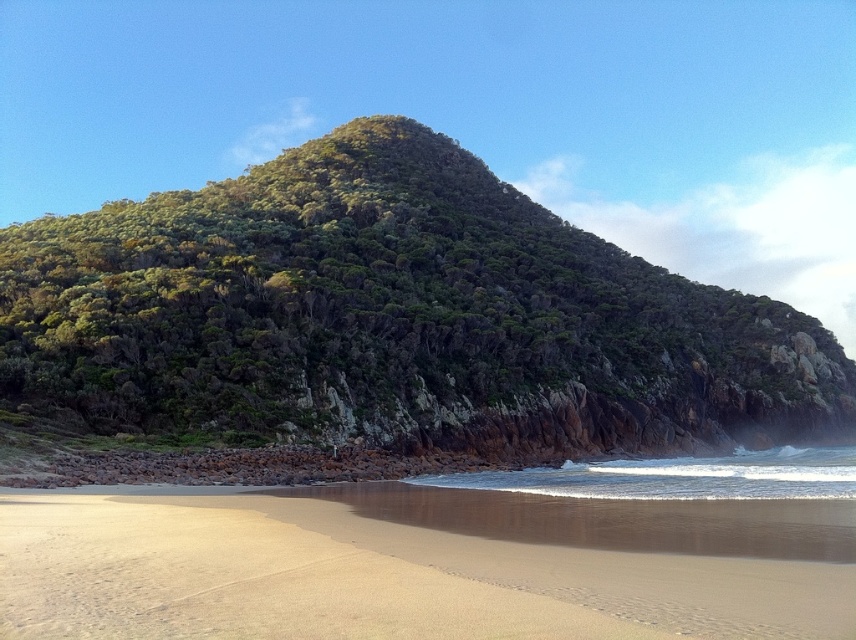
Can you confirm if sandy beach at lower center is smaller than white foamy water at lower center?

Indeed, sandy beach at lower center has a smaller size compared to white foamy water at lower center.

How distant is sandy beach at lower center from white foamy water at lower center?

They are 33.34 meters apart.

Is point (282, 618) farther from camera compared to point (535, 480)?

No, (282, 618) is closer to viewer.

At what (x,y) coordinates should I click in order to perform the action: click on sandy beach at lower center. Please return your answer as a coordinate pair (x, y). The height and width of the screenshot is (640, 856). Looking at the image, I should click on (369, 579).

This screenshot has height=640, width=856. What do you see at coordinates (394, 317) in the screenshot? I see `green rocky cliff at center` at bounding box center [394, 317].

I want to click on green rocky cliff at center, so click(394, 317).

Based on the photo, can you confirm if green rocky cliff at center is positioned to the left of white foamy water at lower center?

Correct, you'll find green rocky cliff at center to the left of white foamy water at lower center.

Who is shorter, green rocky cliff at center or white foamy water at lower center?

white foamy water at lower center

In order to click on green rocky cliff at center in this screenshot , I will do `click(394, 317)`.

In order to click on green rocky cliff at center in this screenshot , I will do `click(394, 317)`.